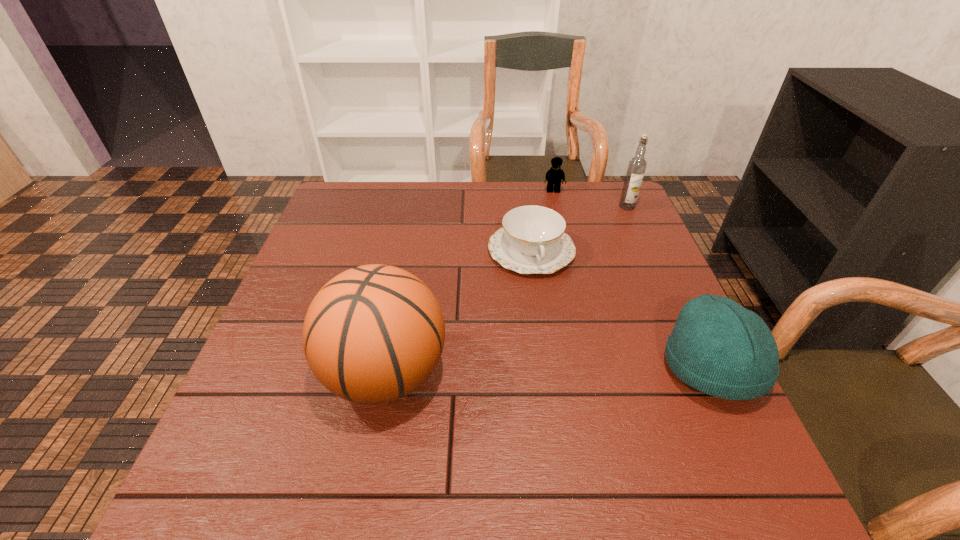
What are the coordinates of `free space between the leftmost object and the third nearest object` in the screenshot? It's located at (458, 312).

Identify the location of free space between the fourth nearest object and the beanie. (669, 287).

Locate an element on the screen. The width and height of the screenshot is (960, 540). unoccupied position between the Lego and the vodka is located at coordinates (590, 199).

Select which object is the fourth closest to the shortest object. Please provide its 2D coordinates. Your answer should be formatted as a tuple, i.e. [(x, y)], where the tuple contains the x and y coordinates of a point satisfying the conditions above.

[(718, 347)]

Identify which object is the third nearest to the leftmost object. Please provide its 2D coordinates. Your answer should be formatted as a tuple, i.e. [(x, y)], where the tuple contains the x and y coordinates of a point satisfying the conditions above.

[(554, 176)]

This screenshot has height=540, width=960. What are the coordinates of `vacant space that satisfies the following two spatial constraints: 1. on the front side of the beanie; 2. on the left side of the second farthest object` in the screenshot? It's located at (700, 368).

This screenshot has width=960, height=540. In order to click on free space that satisfies the following two spatial constraints: 1. on the back side of the leftmost object; 2. on the right side of the Lego in this screenshot , I will do `click(420, 191)`.

What are the coordinates of `blank area in the image that satisfies the following two spatial constraints: 1. on the front side of the farthest object; 2. on the left side of the vodka` in the screenshot? It's located at (557, 206).

Where is `free space that satisfies the following two spatial constraints: 1. on the back side of the chinaware; 2. on the right side of the second farthest object`? free space that satisfies the following two spatial constraints: 1. on the back side of the chinaware; 2. on the right side of the second farthest object is located at coordinates (525, 206).